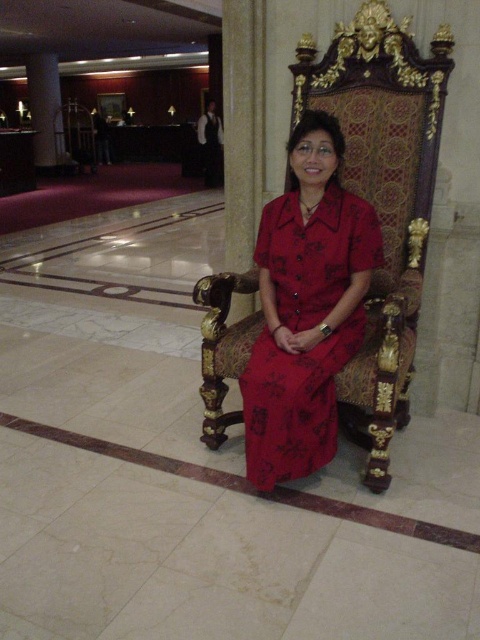
Question: Is wooden carved throne at center further to camera compared to white marble pillar at upper left?

Choices:
 (A) yes
 (B) no

Answer: (B)

Question: Considering the real-world distances, which object is closest to the matte red dress at center?

Choices:
 (A) white marble pillar at upper left
 (B) wooden carved throne at center

Answer: (B)

Question: Does wooden carved throne at center appear on the left side of matte red dress at center?

Choices:
 (A) yes
 (B) no

Answer: (B)

Question: Does wooden carved throne at center have a larger size compared to matte red dress at center?

Choices:
 (A) no
 (B) yes

Answer: (B)

Question: Estimate the real-world distances between objects in this image. Which object is farther from the matte red dress at center?

Choices:
 (A) white marble pillar at upper left
 (B) wooden carved throne at center

Answer: (A)

Question: Estimate the real-world distances between objects in this image. Which object is farther from the wooden carved throne at center?

Choices:
 (A) matte red dress at center
 (B) white marble pillar at upper left

Answer: (B)